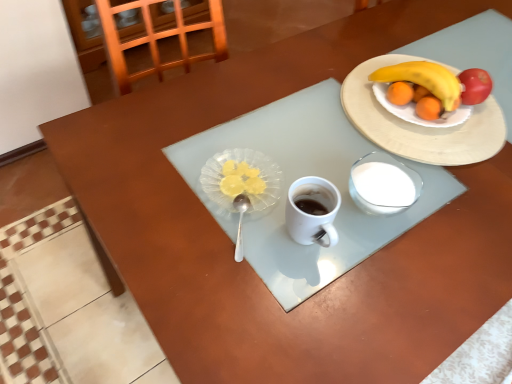
Image resolution: width=512 pixels, height=384 pixels. What do you see at coordinates (240, 223) in the screenshot?
I see `silver metallic spoon at center` at bounding box center [240, 223].

This screenshot has height=384, width=512. What do you see at coordinates (423, 79) in the screenshot?
I see `yellow matte banana at upper right` at bounding box center [423, 79].

What do you see at coordinates (242, 180) in the screenshot? I see `translucent glass plate at center` at bounding box center [242, 180].

I want to click on silver metallic spoon at center, so click(x=240, y=223).

Is yellow matte banana at upper right at the right side of white ceramic plate at upper right?

Incorrect, yellow matte banana at upper right is not on the right side of white ceramic plate at upper right.

You are a GUI agent. You are given a task and a screenshot of the screen. Output one action in this format:
    pyautogui.click(x=<x>, y=<y>)
    Task: Click on the banana lying behind the white ceramic plate at upper right
    This screenshot has width=512, height=384.
    Given the screenshot: What is the action you would take?
    pyautogui.click(x=423, y=79)

Would you say yellow matte banana at upper right is a long distance from white ceramic plate at upper right?

No, yellow matte banana at upper right is not far away from white ceramic plate at upper right.

Measure the distance from yellow matte banana at upper right to white ceramic plate at upper right.

yellow matte banana at upper right is 3.84 inches away from white ceramic plate at upper right.

From a real-world perspective, is white ceramic plate at upper right positioned above or below yellow matte banana at upper right?

white ceramic plate at upper right is situated lower than yellow matte banana at upper right in the real world.

Which is nearer, (437, 148) or (378, 78)?

Positioned in front is point (437, 148).

In terms of height, does white ceramic plate at upper right look taller or shorter compared to yellow matte banana at upper right?

white ceramic plate at upper right is shorter than yellow matte banana at upper right.

From the image's perspective, is white ceramic plate at upper right positioned above or below translucent glass plate at center?

white ceramic plate at upper right is above translucent glass plate at center.

Does white ceramic plate at upper right come in front of translucent glass plate at center?

No, white ceramic plate at upper right is further to the viewer.

Identify the location of plate behind the translucent glass plate at center. Image resolution: width=512 pixels, height=384 pixels. (420, 126).

From a real-world perspective, is white ceramic plate at upper right positioned above or below translucent glass plate at center?

Clearly, from a real-world perspective, white ceramic plate at upper right is below translucent glass plate at center.

This screenshot has width=512, height=384. I want to click on plate behind the silver metallic spoon at center, so click(x=420, y=126).

From a real-world perspective, which is physically below, silver metallic spoon at center or white ceramic plate at upper right?

white ceramic plate at upper right.

Which of these two, silver metallic spoon at center or white ceramic plate at upper right, is wider?

Wider between the two is white ceramic plate at upper right.

Considering the sizes of objects silver metallic spoon at center and white ceramic plate at upper right in the image provided, who is shorter, silver metallic spoon at center or white ceramic plate at upper right?

Standing shorter between the two is white ceramic plate at upper right.

Can you confirm if translucent glass plate at center is bigger than yellow matte banana at upper right?

Actually, translucent glass plate at center might be smaller than yellow matte banana at upper right.

Who is shorter, translucent glass plate at center or yellow matte banana at upper right?

Standing shorter between the two is translucent glass plate at center.

How many degrees apart are the facing directions of translucent glass plate at center and yellow matte banana at upper right?

The angle between the facing direction of translucent glass plate at center and the facing direction of yellow matte banana at upper right is 0.000216 degrees.

Considering the relative sizes of yellow matte banana at upper right and silver metallic spoon at center in the image provided, is yellow matte banana at upper right smaller than silver metallic spoon at center?

Incorrect, yellow matte banana at upper right is not smaller in size than silver metallic spoon at center.

Locate an element on the screen. The width and height of the screenshot is (512, 384). banana above the silver metallic spoon at center (from a real-world perspective) is located at coordinates (423, 79).

Which of these two, yellow matte banana at upper right or silver metallic spoon at center, stands taller?

yellow matte banana at upper right is taller.

Is yellow matte banana at upper right positioned in front of silver metallic spoon at center?

No, yellow matte banana at upper right is further to the viewer.

Considering the relative sizes of translucent glass plate at center and white ceramic plate at upper right in the image provided, is translucent glass plate at center smaller than white ceramic plate at upper right?

Yes, translucent glass plate at center is smaller than white ceramic plate at upper right.

Does translucent glass plate at center touch white ceramic plate at upper right?

No.

Considering their positions, is translucent glass plate at center located in front of or behind white ceramic plate at upper right?

Clearly, translucent glass plate at center is in front of white ceramic plate at upper right.

Where is `banana that appears above the white ceramic plate at upper right (from a real-world perspective)`? Image resolution: width=512 pixels, height=384 pixels. banana that appears above the white ceramic plate at upper right (from a real-world perspective) is located at coordinates (423, 79).

Locate an element on the screen. This screenshot has width=512, height=384. banana lying on the left of white ceramic plate at upper right is located at coordinates (423, 79).

Which object lies nearer to the anchor point translucent glass plate at center, yellow matte banana at upper right or silver metallic spoon at center?

silver metallic spoon at center lies closer to translucent glass plate at center than the other object.

Estimate the real-world distances between objects in this image. Which object is further from white ceramic plate at upper right, translucent glass plate at center or yellow matte banana at upper right?

translucent glass plate at center is positioned further to the anchor white ceramic plate at upper right.

From the image, which object appears to be farther from silver metallic spoon at center, yellow matte banana at upper right or translucent glass plate at center?

yellow matte banana at upper right is positioned further to the anchor silver metallic spoon at center.

From the image, which object appears to be nearer to silver metallic spoon at center, white ceramic plate at upper right or translucent glass plate at center?

The object closer to silver metallic spoon at center is translucent glass plate at center.

From the image, which object appears to be nearer to yellow matte banana at upper right, silver metallic spoon at center or translucent glass plate at center?

translucent glass plate at center is closer to yellow matte banana at upper right.

Considering their positions, is translucent glass plate at center positioned closer to silver metallic spoon at center than yellow matte banana at upper right?

translucent glass plate at center is closer to silver metallic spoon at center.

From the image, which object appears to be nearer to white ceramic plate at upper right, silver metallic spoon at center or yellow matte banana at upper right?

The object closer to white ceramic plate at upper right is yellow matte banana at upper right.

Considering their positions, is translucent glass plate at center positioned further to white ceramic plate at upper right than silver metallic spoon at center?

The object further to white ceramic plate at upper right is silver metallic spoon at center.

You are a GUI agent. You are given a task and a screenshot of the screen. Output one action in this format:
    pyautogui.click(x=<x>, y=<y>)
    Task: Click on the utensil between translucent glass plate at center and yellow matte banana at upper right from left to right
    This screenshot has width=512, height=384.
    Given the screenshot: What is the action you would take?
    pyautogui.click(x=240, y=223)

This screenshot has width=512, height=384. In order to click on banana located between silver metallic spoon at center and white ceramic plate at upper right in the left-right direction in this screenshot , I will do `click(423, 79)`.

Where is `utensil situated between translucent glass plate at center and white ceramic plate at upper right from left to right`? The image size is (512, 384). utensil situated between translucent glass plate at center and white ceramic plate at upper right from left to right is located at coordinates (240, 223).

The height and width of the screenshot is (384, 512). Find the location of `banana located between translucent glass plate at center and white ceramic plate at upper right in the left-right direction`. banana located between translucent glass plate at center and white ceramic plate at upper right in the left-right direction is located at coordinates (423, 79).